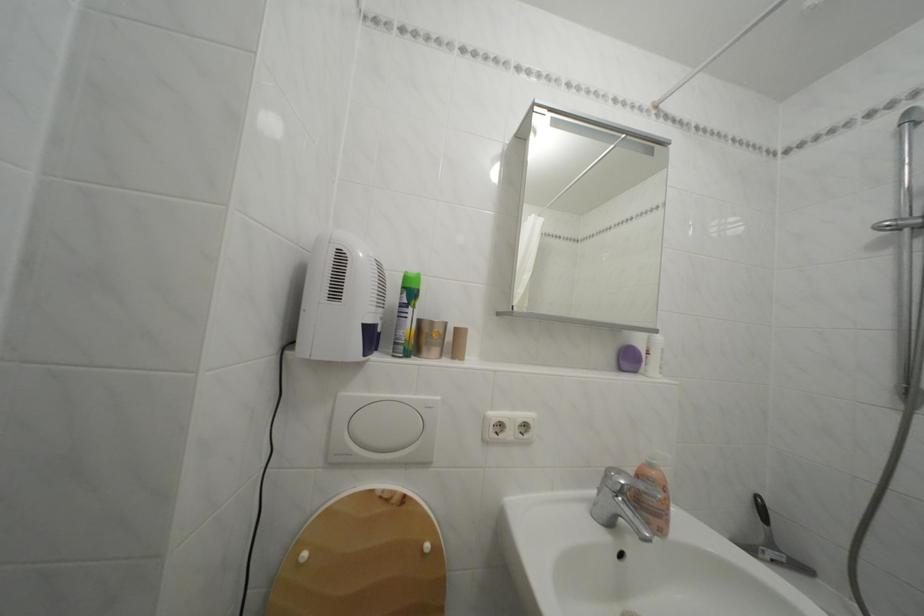
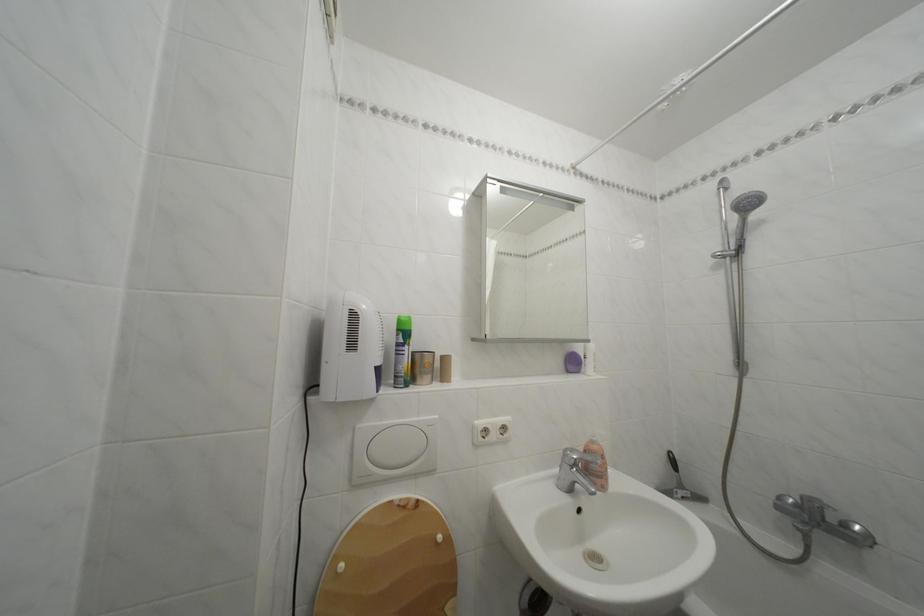
The point at (627, 477) is marked in the first image. Where is the corresponding point in the second image?

(581, 456)